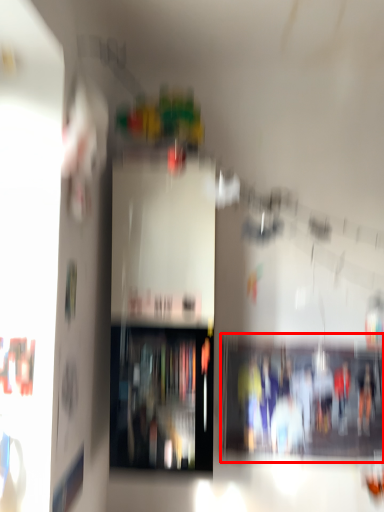
Question: From the image's perspective, what is the correct spatial relationship of shelf (annotated by the red box) in relation to shelf?

Choices:
 (A) above
 (B) below

Answer: (B)